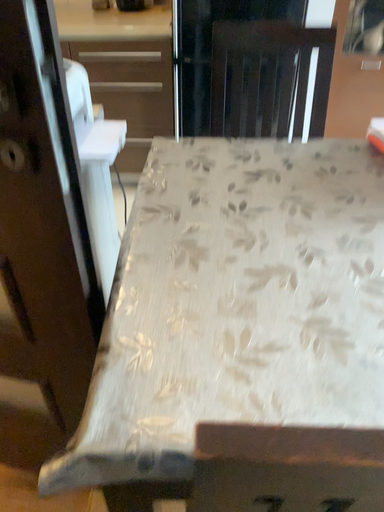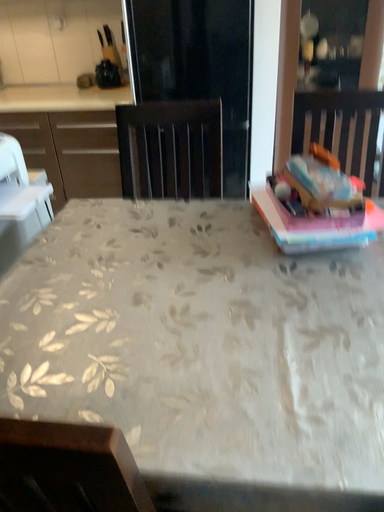
Question: Which way did the camera rotate in the video?

Choices:
 (A) rotated upward
 (B) rotated downward

Answer: (A)